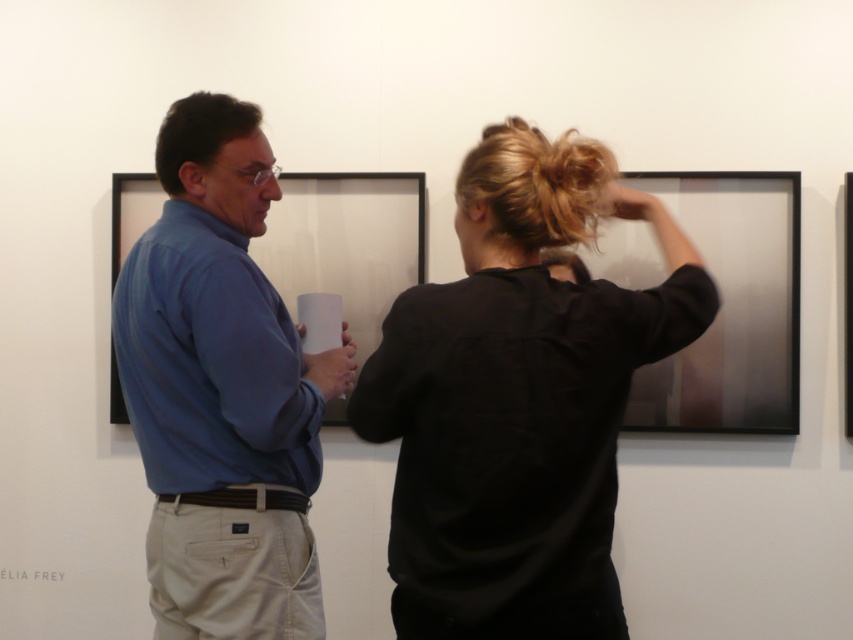
Question: Which object is closer to the camera taking this photo?

Choices:
 (A) matte blue shirt at left
 (B) matte black picture frame at upper right

Answer: (A)

Question: Which of the following is the closest to the observer?

Choices:
 (A) (849, 346)
 (B) (212, 444)

Answer: (B)

Question: Where is blue cotton shirt at center located in relation to matte blue shirt at left in the image?

Choices:
 (A) above
 (B) below

Answer: (A)

Question: Based on their relative distances, which object is farther from the blue cotton shirt at center?

Choices:
 (A) matte blue shirt at left
 (B) black matte shirt at center
 (C) black matte picture frame at right
 (D) matte black picture frame at upper right

Answer: (C)

Question: Does matte black picture frame at upper right appear on the left side of black matte picture frame at right?

Choices:
 (A) yes
 (B) no

Answer: (A)

Question: Does matte blue shirt at left appear on the left side of matte black picture frame at upper right?

Choices:
 (A) no
 (B) yes

Answer: (B)